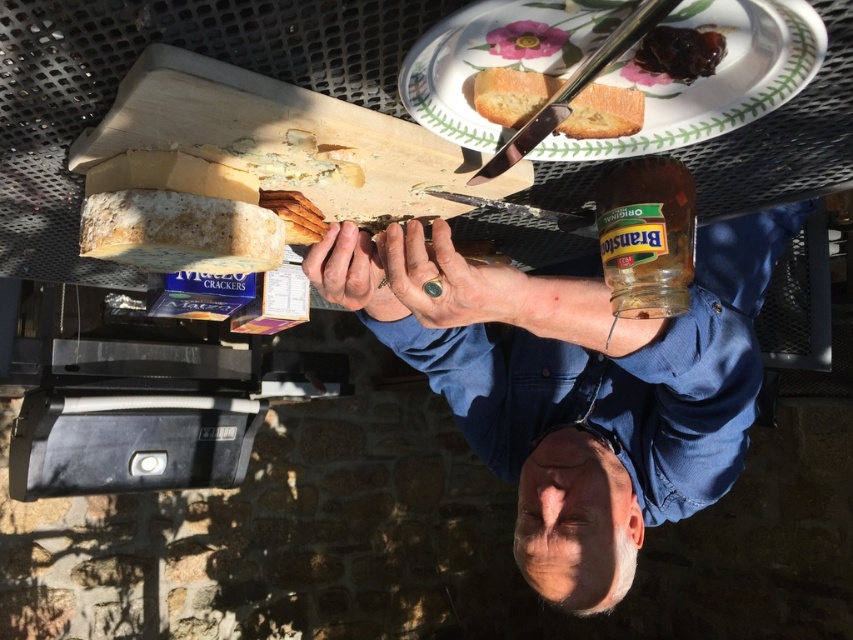
You are at a picnic and need to reach the jar labeled Original Branston Pickle on the table. You are currently standing at the blue denim shirt at center. Which direction should you move to get to the jar?

The blue denim shirt at center is located at point (x=587, y=388). Since the jar is on the table in the background, you should move forward from the blue denim shirt at center to reach the jar.

You are a food photographer setting up a shot of the blue denim shirt at center and the golden brown crusty bread at upper center. Which object should you place closer to the camera to ensure both appear equally wide in the photo?

Place the golden brown crusty bread at upper center closer to the camera because the blue denim shirt at center is wider in reality. By positioning the smaller object nearer, their apparent widths in the photo will balance out.

You are a guest at the picnic and want to grab the golden brown crusty bread at upper center to make a sandwich. However, there is a blue denim shirt at center in the way. Based on their positions, can you reach the bread without moving the shirt?

The blue denim shirt at center is positioned on the right side of golden brown crusty bread at upper center, so you can reach the bread by moving to the left side of the shirt to access it without needing to move the shirt.